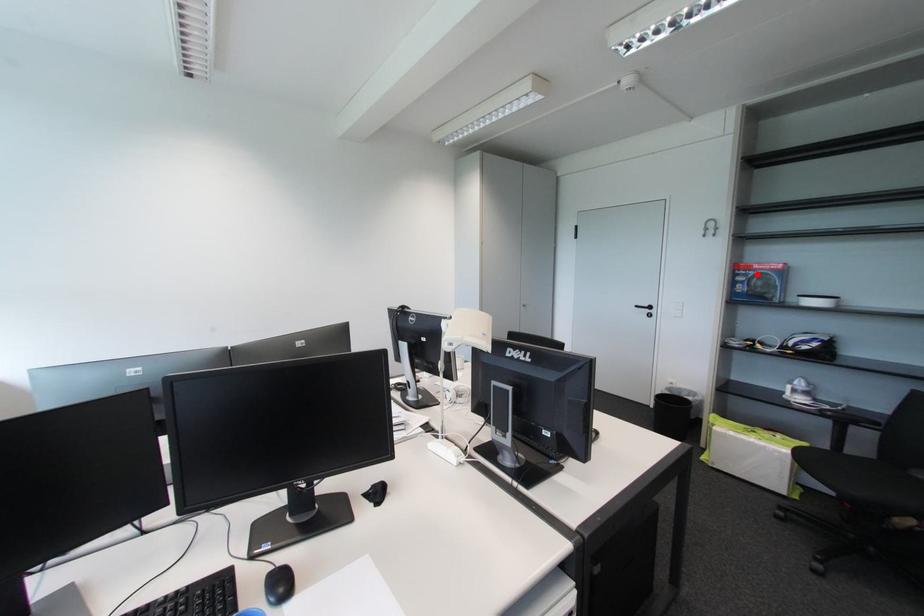
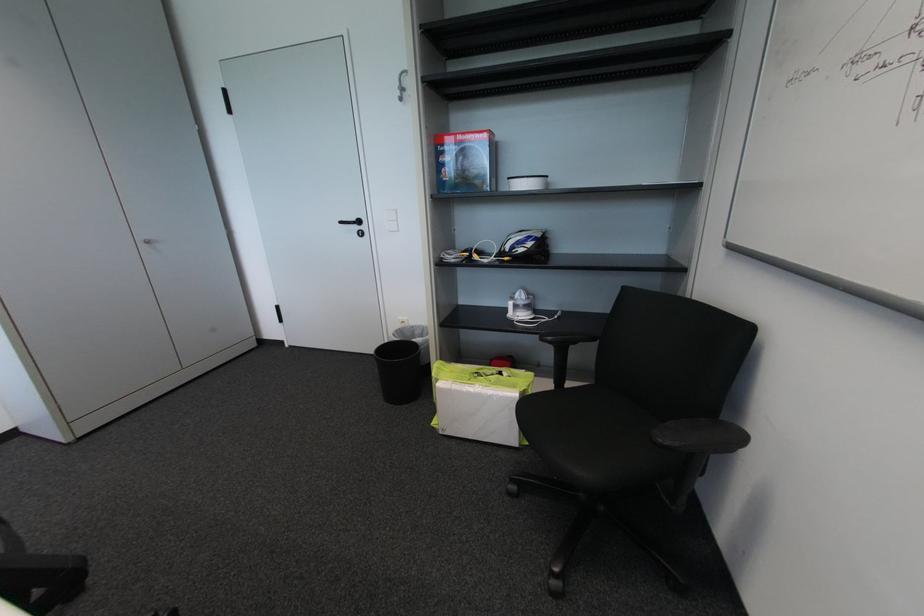
Where in the second image is the point corresponding to the highlighted location from the first image?

(460, 148)